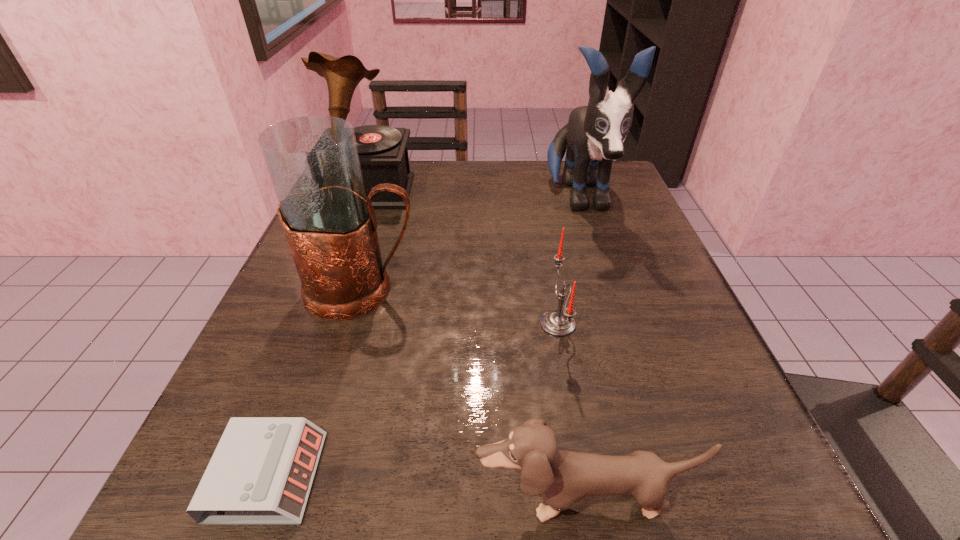
Locate an element on the screen. This screenshot has width=960, height=540. free space that satisfies the following two spatial constraints: 1. on the front-facing side of the candle; 2. on the front side of the shortest object is located at coordinates (585, 476).

You are a GUI agent. You are given a task and a screenshot of the screen. Output one action in this format:
    pyautogui.click(x=<x>, y=<y>)
    Task: Click on the vacant space that satisfies the following two spatial constraints: 1. on the front-facing side of the candle; 2. at the face of the nearer puppy
    
    Given the screenshot: What is the action you would take?
    pyautogui.click(x=589, y=499)

The height and width of the screenshot is (540, 960). Find the location of `vacant point that satisfies the following two spatial constraints: 1. on the front-facing side of the taller puppy; 2. on the front-facing side of the candle`. vacant point that satisfies the following two spatial constraints: 1. on the front-facing side of the taller puppy; 2. on the front-facing side of the candle is located at coordinates (619, 323).

At what (x,y) coordinates should I click in order to perform the action: click on vacant region that satisfies the following two spatial constraints: 1. at the horn opening of the alarm clock; 2. on the right side of the phonograph_record. Please return your answer as a coordinate pair (x, y). Looking at the image, I should click on (263, 476).

Locate an element on the screen. vacant space that satisfies the following two spatial constraints: 1. at the horn opening of the shortest object; 2. on the right side of the phonograph_record is located at coordinates (263, 476).